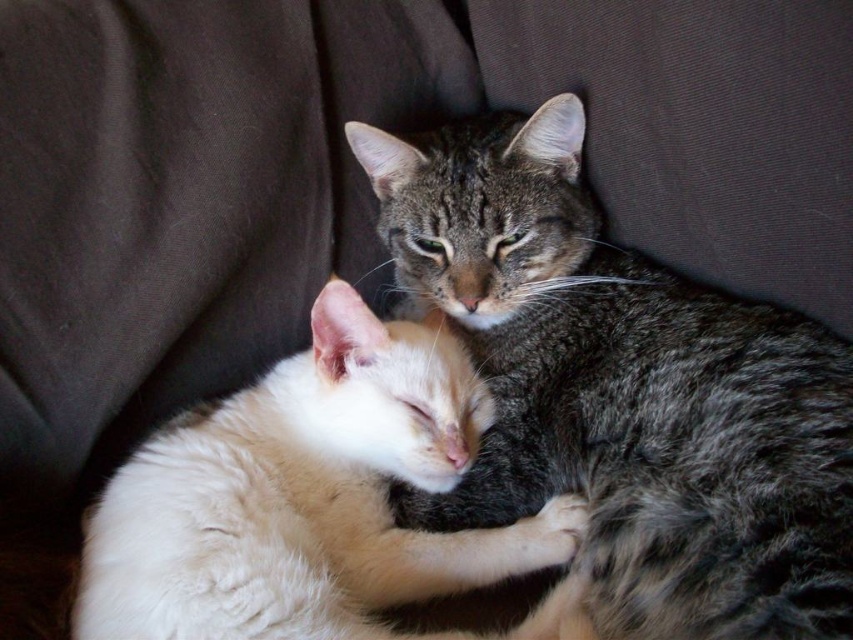
Is gray tabby cat at center further to the viewer compared to fluffy white cat at center?

No.

Between gray tabby cat at center and fluffy white cat at center, which one has less height?

Standing shorter between the two is fluffy white cat at center.

Based on the photo, measure the distance between point (399, 241) and camera.

A distance of 1.40 meters exists between point (399, 241) and camera.

Locate an element on the screen. gray tabby cat at center is located at coordinates (624, 390).